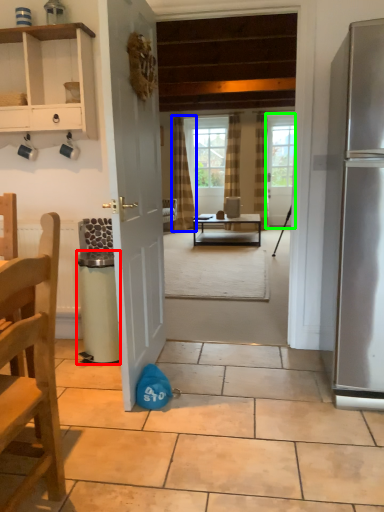
Question: Considering the real-world distances, which object is closest to trash bin/can (highlighted by a red box)? curtain (highlighted by a blue box) or door (highlighted by a green box).

Choices:
 (A) curtain
 (B) door

Answer: (A)